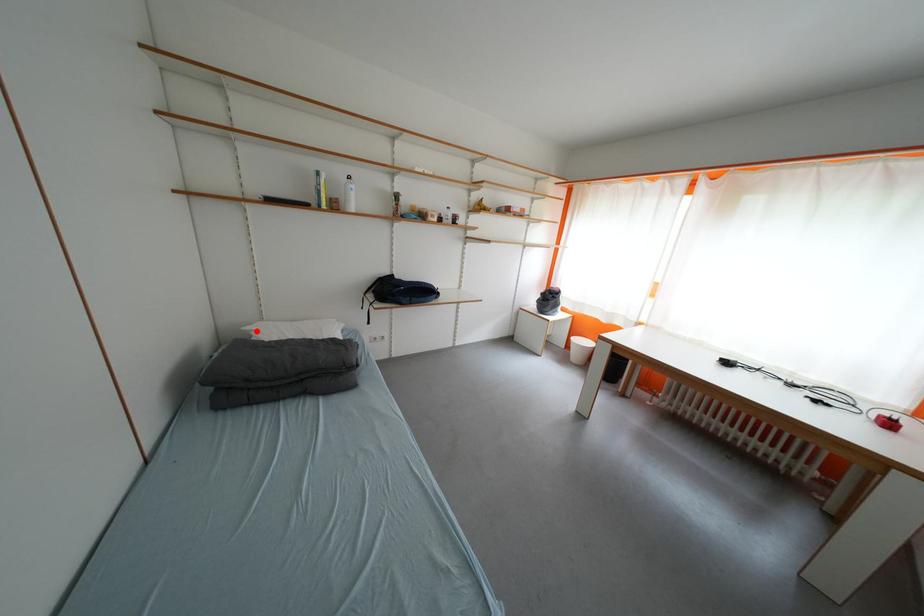
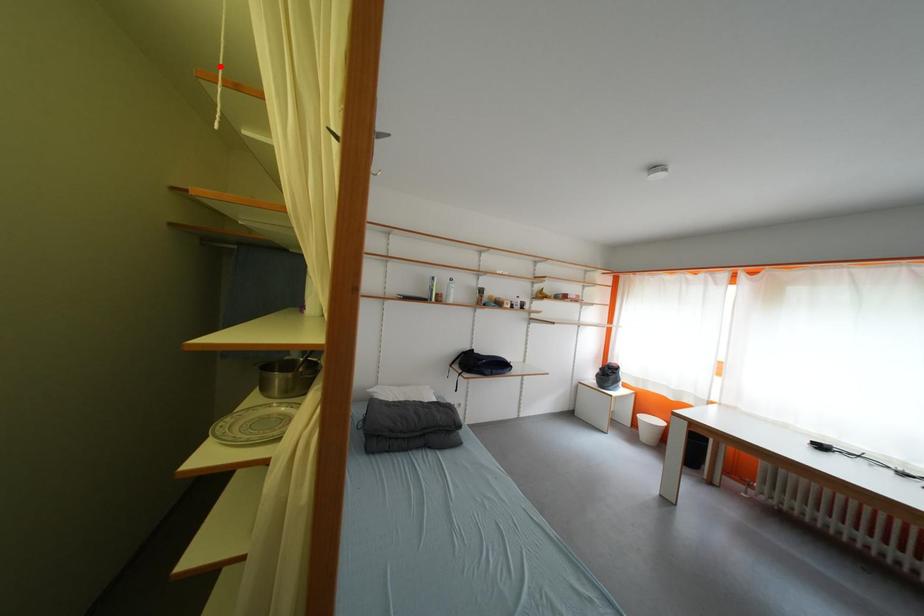
I am providing you with two images of the same scene from different viewpoints. A red point is marked on the first image and another point is marked on the second image. Do the highlighted points in image1 and image2 indicate the same real-world spot?

No